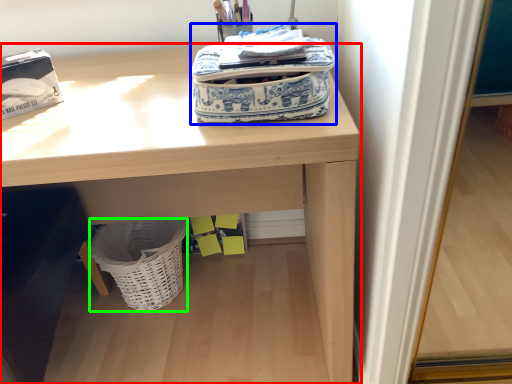
Question: Which object is positioned farthest from desk (highlighted by a red box)? Select from bag (highlighted by a blue box) and basket (highlighted by a green box).

Choices:
 (A) bag
 (B) basket

Answer: (B)